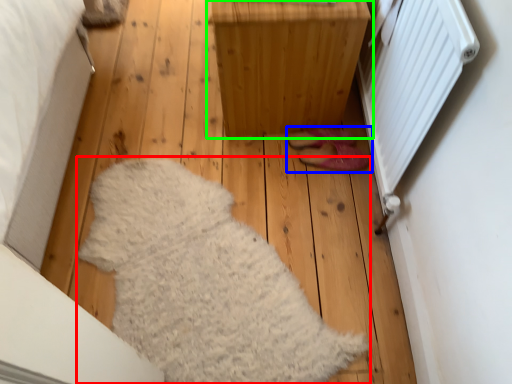
Question: Considering the real-world distances, which object is closest to blanket (highlighted by a red box)? footwear (highlighted by a blue box) or furniture (highlighted by a green box).

Choices:
 (A) footwear
 (B) furniture

Answer: (B)